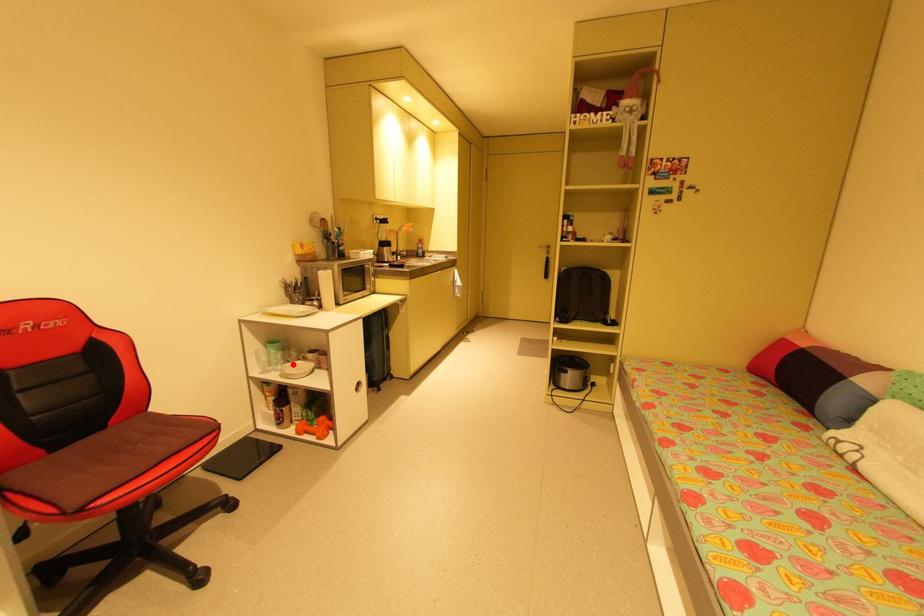
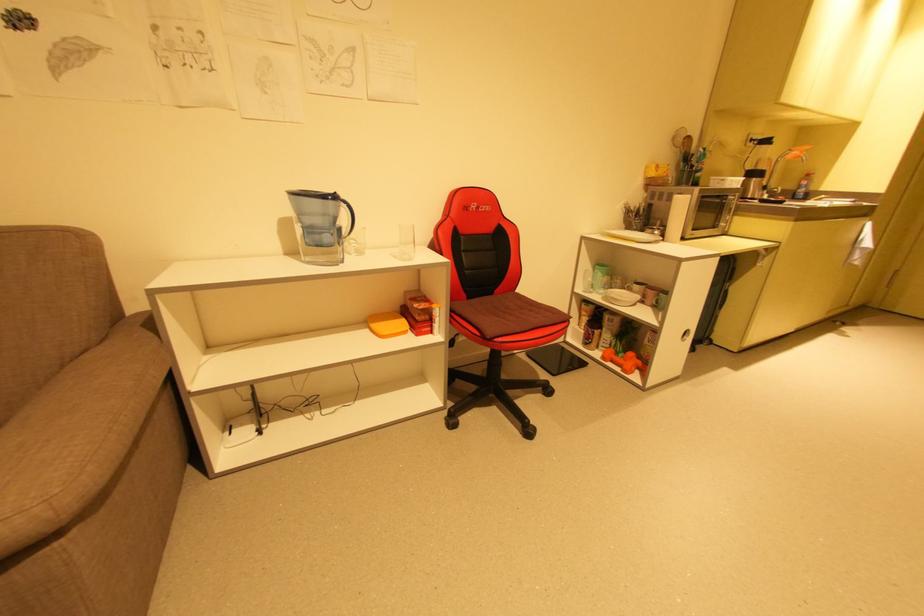
Question: I am providing you with two images of the same scene from different viewpoints. A red point is shown in image1. For the corresponding object point in image2, is it positioned nearer or farther from the camera?

Choices:
 (A) Nearer
 (B) Farther

Answer: (A)